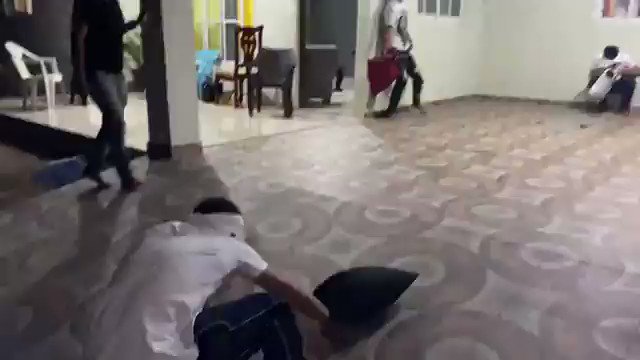
This screenshot has height=360, width=640. What are the coordinates of `column` in the screenshot? It's located at (168, 108).